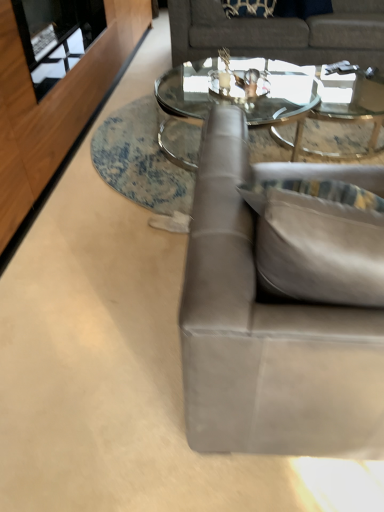
Question: Can we say clear glass coffee table at center lies outside suede gray couch at right, which appears as the second studio couch when viewed from the back?

Choices:
 (A) no
 (B) yes

Answer: (B)

Question: Is clear glass coffee table at center in contact with suede gray couch at right, placed as the first studio couch when sorted from bottom to top?

Choices:
 (A) no
 (B) yes

Answer: (A)

Question: Is clear glass coffee table at center facing towards suede gray couch at right, placed as the first studio couch when sorted from bottom to top?

Choices:
 (A) no
 (B) yes

Answer: (A)

Question: Is clear glass coffee table at center closer to the viewer compared to suede gray couch at right, the 2th studio couch in the top-to-bottom sequence?

Choices:
 (A) yes
 (B) no

Answer: (B)

Question: Are clear glass coffee table at center and suede gray couch at right, the 2th studio couch in the top-to-bottom sequence, located far from each other?

Choices:
 (A) yes
 (B) no

Answer: (A)

Question: Is clear glass coffee table at center taller than suede gray couch at right, acting as the first studio couch starting from the front?

Choices:
 (A) no
 (B) yes

Answer: (A)

Question: Considering the relative sizes of transparent glass door at upper left and suede gray couch at right, acting as the first studio couch starting from the front, in the image provided, is transparent glass door at upper left taller than suede gray couch at right, acting as the first studio couch starting from the front,?

Choices:
 (A) yes
 (B) no

Answer: (B)

Question: Is transparent glass door at upper left not inside suede gray couch at right, placed as the first studio couch when sorted from bottom to top?

Choices:
 (A) no
 (B) yes

Answer: (B)

Question: Is transparent glass door at upper left oriented towards suede gray couch at right, the 2th studio couch in the top-to-bottom sequence?

Choices:
 (A) yes
 (B) no

Answer: (B)

Question: Does transparent glass door at upper left have a lesser height compared to suede gray couch at right, acting as the first studio couch starting from the front?

Choices:
 (A) yes
 (B) no

Answer: (A)

Question: From a real-world perspective, does transparent glass door at upper left sit lower than suede gray couch at right, placed as the first studio couch when sorted from bottom to top?

Choices:
 (A) yes
 (B) no

Answer: (B)

Question: Is transparent glass door at upper left not close to suede gray couch at right, acting as the first studio couch starting from the front?

Choices:
 (A) yes
 (B) no

Answer: (A)

Question: Does gray fabric couch at upper center, marked as the 1th studio couch in a top-to-bottom arrangement, have a lesser width compared to suede gray couch at right, acting as the first studio couch starting from the front?

Choices:
 (A) yes
 (B) no

Answer: (B)